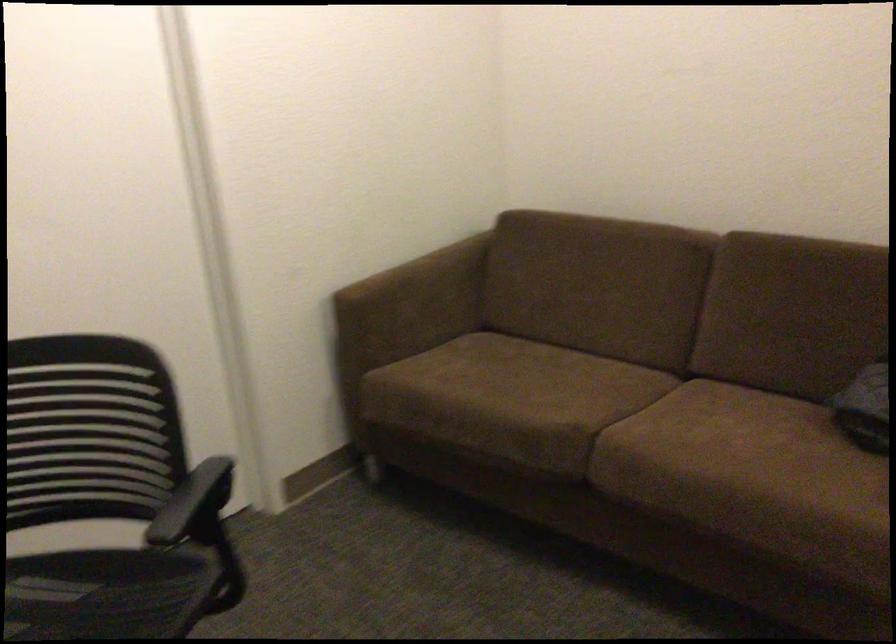
Find where to resting arm the brown sofa armrest. Please return your answer as a coordinate pair (x, y).

(364, 304)